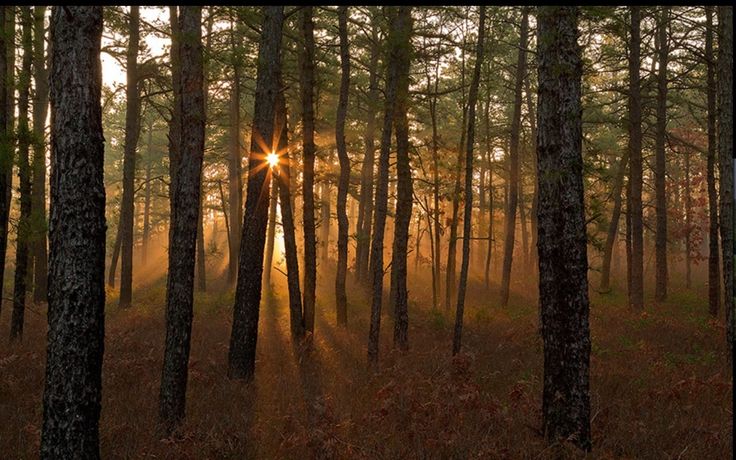
Identify the location of orange light. (277, 280), (152, 253), (413, 269), (352, 223), (269, 157).